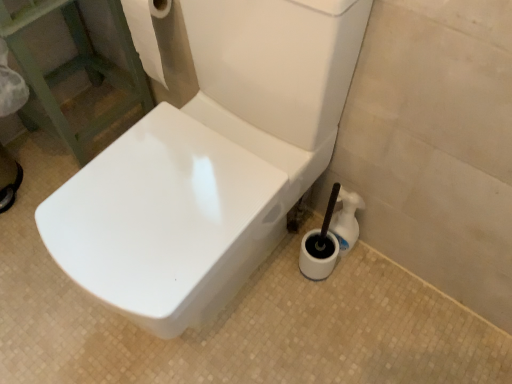
Question: Does white paper towel at upper left have a lesser width compared to white glossy toilet brush at lower right?

Choices:
 (A) yes
 (B) no

Answer: (B)

Question: Does white paper towel at upper left come in front of white glossy toilet brush at lower right?

Choices:
 (A) no
 (B) yes

Answer: (B)

Question: Is the depth of white paper towel at upper left greater than that of white glossy toilet brush at lower right?

Choices:
 (A) no
 (B) yes

Answer: (A)

Question: From the image's perspective, is white paper towel at upper left located beneath white glossy toilet brush at lower right?

Choices:
 (A) no
 (B) yes

Answer: (A)

Question: From the image's perspective, is white paper towel at upper left above white glossy toilet brush at lower right?

Choices:
 (A) yes
 (B) no

Answer: (A)

Question: Is white paper towel at upper left shorter than white glossy toilet brush at lower right?

Choices:
 (A) no
 (B) yes

Answer: (A)

Question: From the image's perspective, would you say white glossy toilet at center is positioned over white glossy toilet brush at lower right?

Choices:
 (A) no
 (B) yes

Answer: (B)

Question: Considering the relative sizes of white glossy toilet at center and white glossy toilet brush at lower right in the image provided, is white glossy toilet at center thinner than white glossy toilet brush at lower right?

Choices:
 (A) no
 (B) yes

Answer: (A)

Question: Is white glossy toilet at center shorter than white glossy toilet brush at lower right?

Choices:
 (A) no
 (B) yes

Answer: (A)

Question: Can you confirm if white glossy toilet at center is bigger than white glossy toilet brush at lower right?

Choices:
 (A) yes
 (B) no

Answer: (A)

Question: Considering the relative positions of white glossy toilet at center and white glossy toilet brush at lower right in the image provided, is white glossy toilet at center behind white glossy toilet brush at lower right?

Choices:
 (A) yes
 (B) no

Answer: (B)

Question: Can you confirm if white glossy toilet at center is smaller than white glossy toilet brush at lower right?

Choices:
 (A) no
 (B) yes

Answer: (A)

Question: Does white glossy toilet brush at lower right have a lesser height compared to white glossy toilet at center?

Choices:
 (A) no
 (B) yes

Answer: (B)